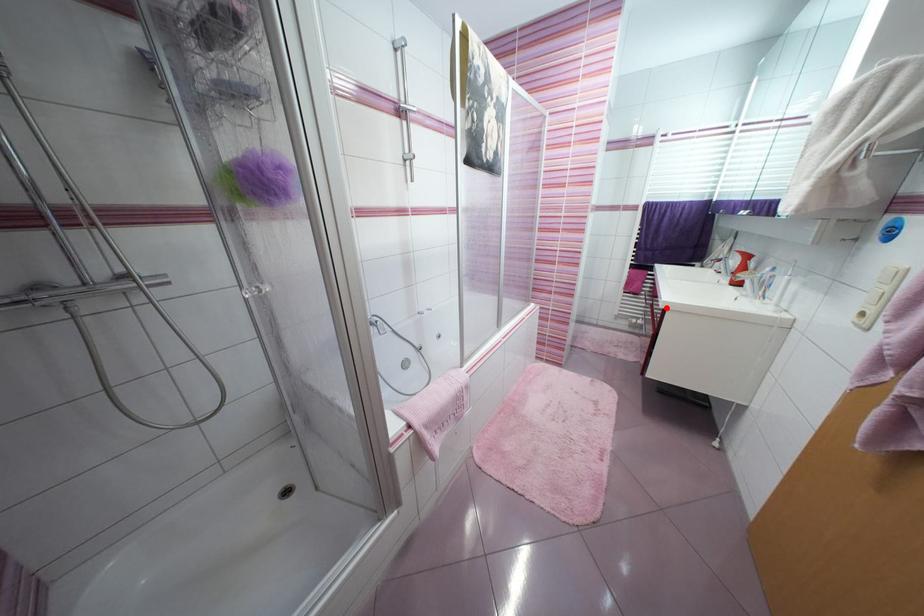
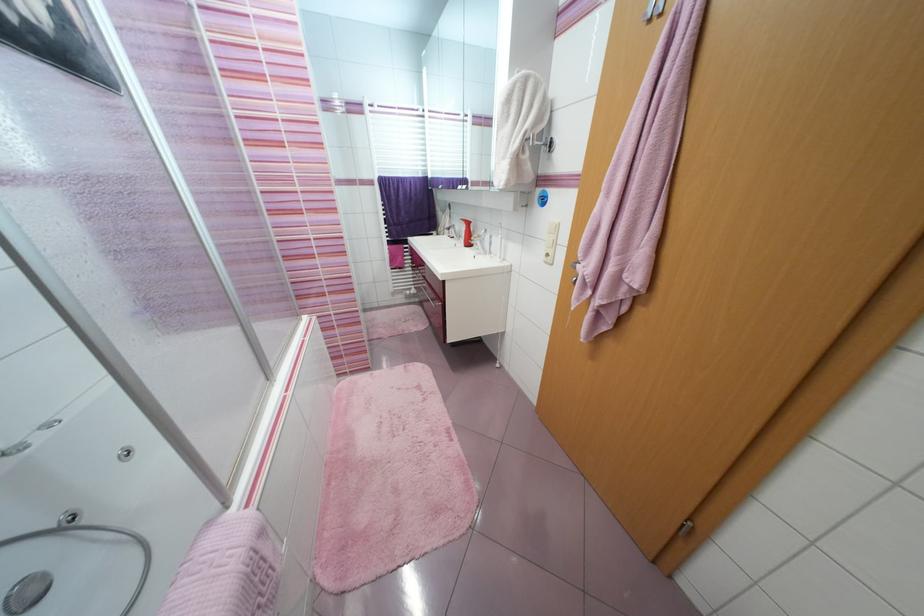
Question: I am providing you with two images of the same scene from different viewpoints. Given a red point in image1, look at the same physical point in image2. Is it:

Choices:
 (A) Closer to the viewpoint
 (B) Farther from the viewpoint

Answer: (B)